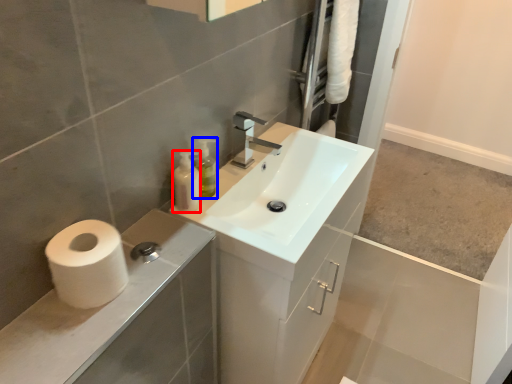
Question: Among these objects, which one is nearest to the camera, toiletry (highlighted by a red box) or soap dispenser (highlighted by a blue box)?

Choices:
 (A) toiletry
 (B) soap dispenser

Answer: (A)